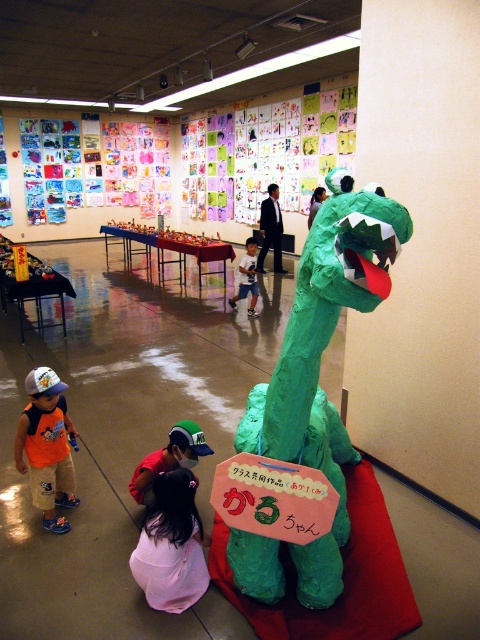
Question: Can you confirm if pink fabric dress at lower center is wider than reddish-orange fabric at lower center?

Choices:
 (A) yes
 (B) no

Answer: (B)

Question: Estimate the real-world distances between objects in this image. Which object is farther from the light blue fabric shirt at center?

Choices:
 (A) green papier-mâché dinosaur at center
 (B) orange cotton shirt at lower left

Answer: (A)

Question: Can you confirm if green papier-mâché dinosaur at center is smaller than orange cotton shirt at lower left?

Choices:
 (A) yes
 (B) no

Answer: (B)

Question: Which point appears farthest from the camera in this image?

Choices:
 (A) (162, 452)
 (B) (144, 573)
 (C) (255, 280)
 (D) (55, 490)

Answer: (C)

Question: Which of the following is the farthest from the observer?

Choices:
 (A) reddish-orange fabric at lower center
 (B) pink fabric dress at lower center
 (C) light blue fabric shirt at center

Answer: (C)

Question: Is orange cotton shirt at lower left bigger than reddish-orange fabric at lower center?

Choices:
 (A) no
 (B) yes

Answer: (B)